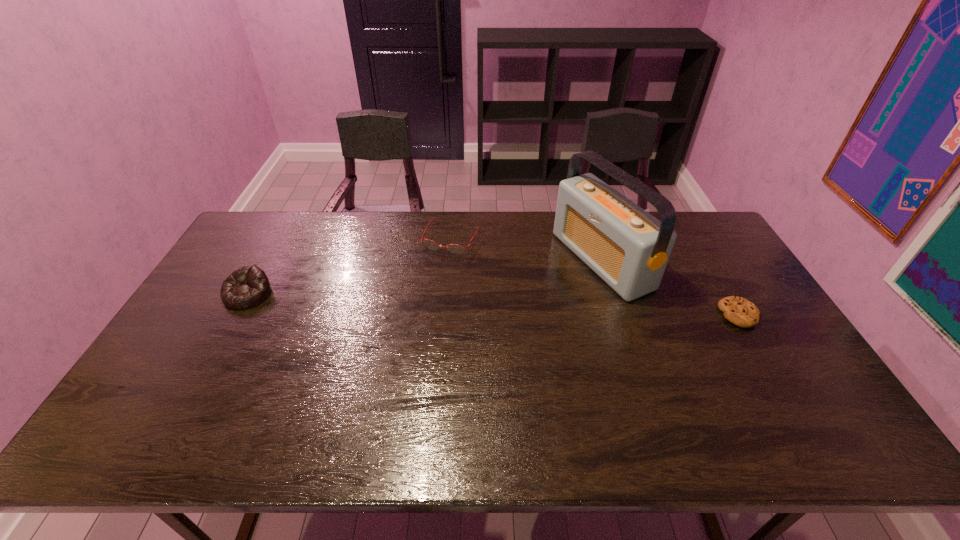
You are a GUI agent. You are given a task and a screenshot of the screen. Output one action in this format:
    pyautogui.click(x=<x>, y=<y>)
    Task: Click on the beanbag
    The image size is (960, 540).
    Given the screenshot: What is the action you would take?
    pyautogui.click(x=248, y=286)

Locate an element on the screen. the second tallest object is located at coordinates (248, 286).

I want to click on the rightmost object, so click(x=737, y=310).

I want to click on cookie, so click(737, 310).

Locate an element on the screen. the second object from right to left is located at coordinates (628, 248).

Where is `radio receiver`? radio receiver is located at coordinates (628, 248).

At what (x,y) coordinates should I click in order to perform the action: click on the second object from left to right. Please return your answer as a coordinate pair (x, y). Looking at the image, I should click on (453, 248).

Locate an element on the screen. This screenshot has width=960, height=540. the second shortest object is located at coordinates (453, 248).

Locate an element on the screen. This screenshot has width=960, height=540. vacant space located on the right of the leftmost object is located at coordinates (340, 294).

Where is `vacant space situated on the back of the cookie`? This screenshot has height=540, width=960. vacant space situated on the back of the cookie is located at coordinates (689, 232).